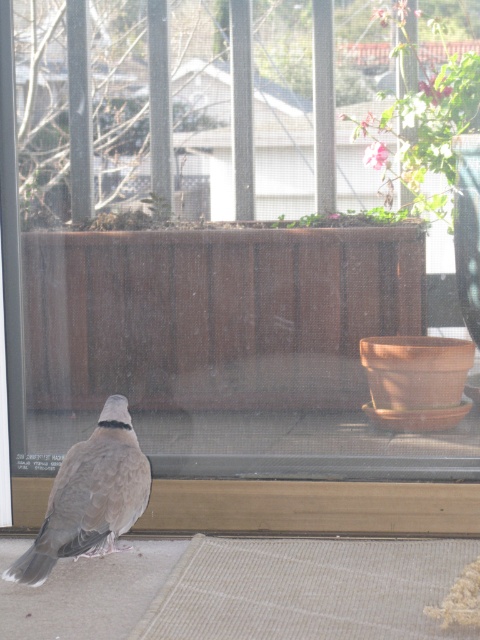
You are a photographer trying to capture the gray matte bird at lower left through the clear plastic screen door at left. Since the screen door might affect the clarity, will the bird appear larger in your photo compared to the door?

The gray matte bird at lower left is larger in size than the clear plastic screen door at left, so yes, the bird will appear larger in the photo than the door.